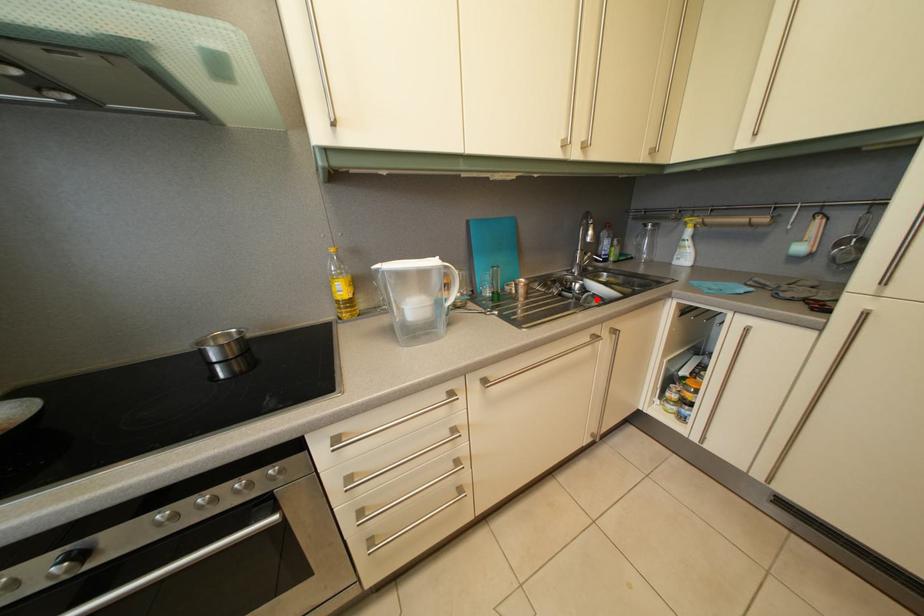
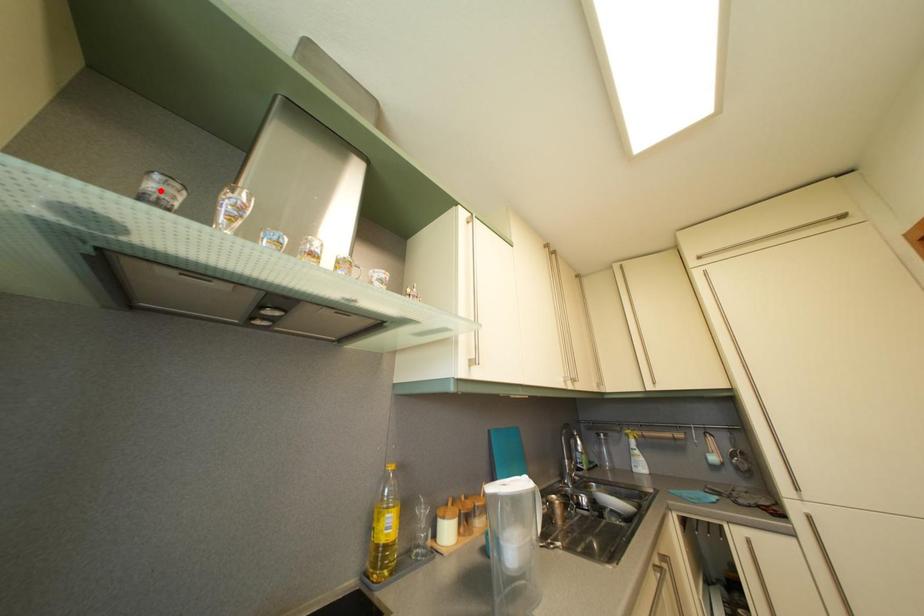
Consider the image. I am providing you with two images of the same scene from different viewpoints. A red point is marked on the first image and another point is marked on the second image. Are the points marked in image1 and image2 representing the same 3D position?

No